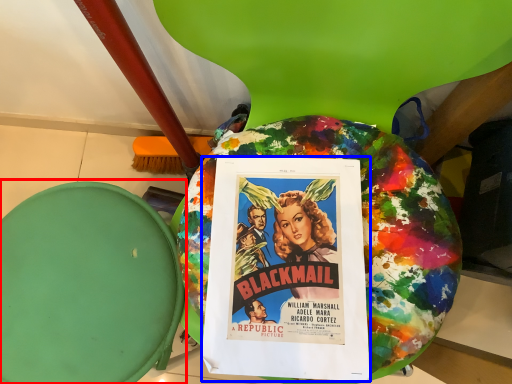
Question: Among these objects, which one is nearest to the camera, bean bag chair (highlighted by a red box) or poster (highlighted by a blue box)?

Choices:
 (A) bean bag chair
 (B) poster

Answer: (B)